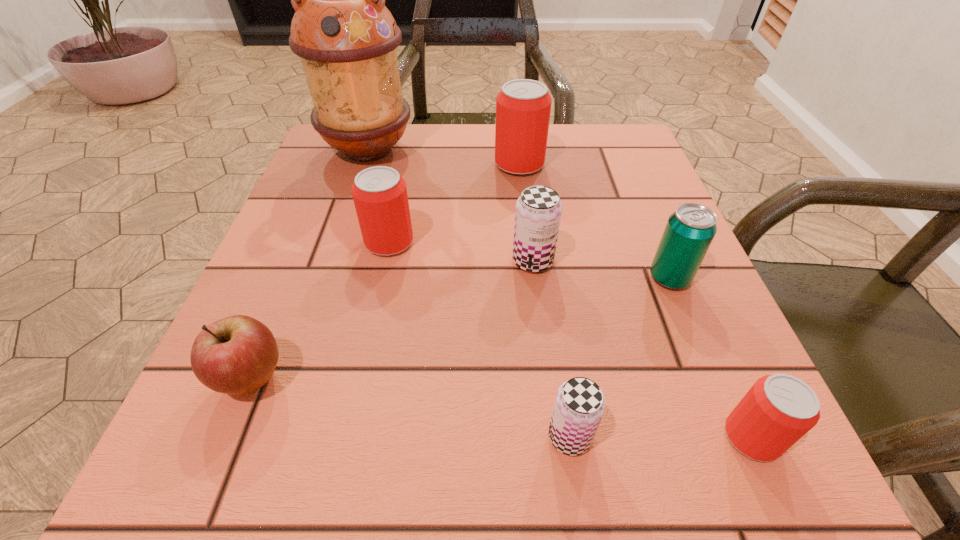
Where is `free spot between the bigger purple beer can and the teal beer can`? This screenshot has height=540, width=960. free spot between the bigger purple beer can and the teal beer can is located at coordinates (601, 269).

Identify the location of free space between the nearer purple beer can and the leftmost red beer can. (479, 339).

I want to click on vacant space that is in between the oil lamp and the third nearest object, so click(311, 264).

Identify the location of free spot between the oil lamp and the farther purple beer can. This screenshot has height=540, width=960. (450, 205).

Locate which object is the sixth closest to the farther purple beer can. Please provide its 2D coordinates. Your answer should be formatted as a tuple, i.e. [(x, y)], where the tuple contains the x and y coordinates of a point satisfying the conditions above.

[(346, 38)]

Locate which object is the closest to the rightmost red beer can. Please provide its 2D coordinates. Your answer should be formatted as a tuple, i.e. [(x, y)], where the tuple contains the x and y coordinates of a point satisfying the conditions above.

[(579, 406)]

The image size is (960, 540). What are the coordinates of `beer can identified as the second closest to the teal beer can` in the screenshot? It's located at (779, 409).

Identify which beer can is the third nearest to the teal beer can. Please provide its 2D coordinates. Your answer should be formatted as a tuple, i.e. [(x, y)], where the tuple contains the x and y coordinates of a point satisfying the conditions above.

[(579, 406)]

This screenshot has height=540, width=960. Identify the location of red beer can that is the closest to the oil lamp. (379, 193).

Identify which red beer can is the third closest to the third nearest object. Please provide its 2D coordinates. Your answer should be formatted as a tuple, i.e. [(x, y)], where the tuple contains the x and y coordinates of a point satisfying the conditions above.

[(779, 409)]